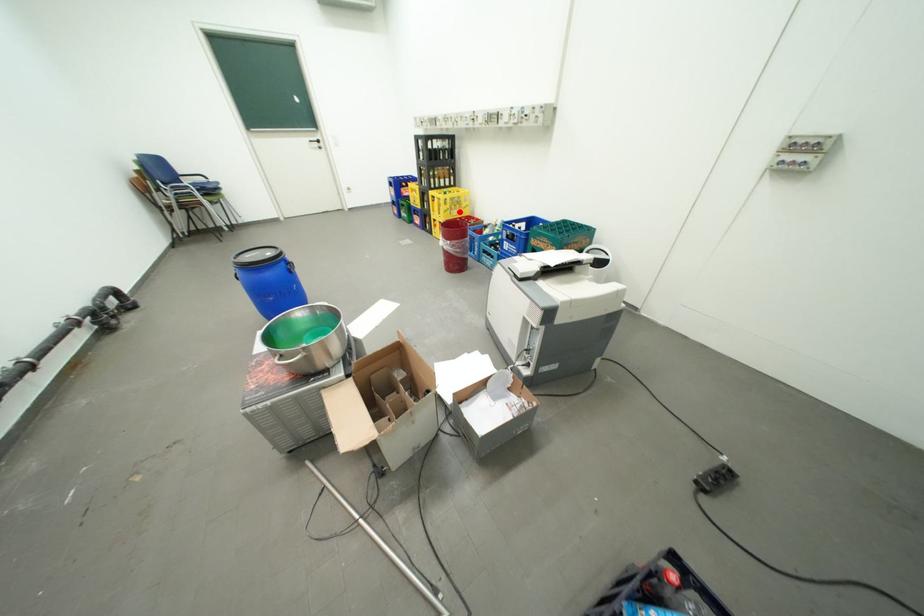
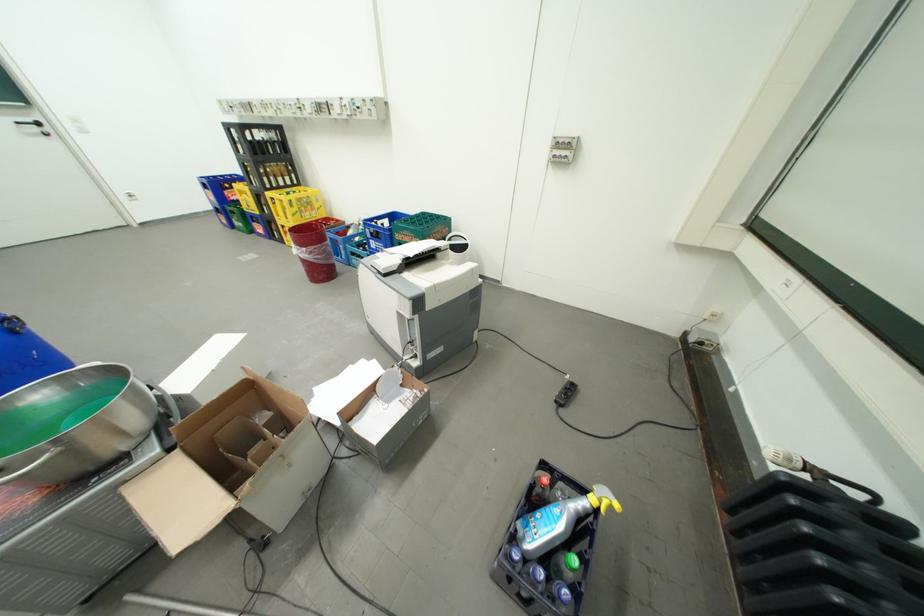
Locate, in the second image, the point that corresponds to the highlighted location in the first image.

(310, 215)